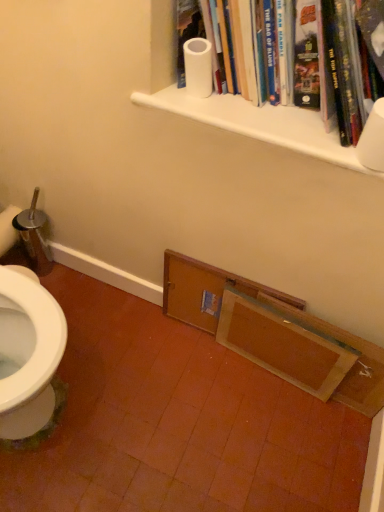
You are a GUI agent. You are given a task and a screenshot of the screen. Output one action in this format:
    pyautogui.click(x=<x>, y=<y>)
    Task: Click on the free location in front of white matte toilet paper at upper center, the 2th toilet paper when ordered from bottom to top
    The width and height of the screenshot is (384, 512).
    Given the screenshot: What is the action you would take?
    pyautogui.click(x=209, y=110)